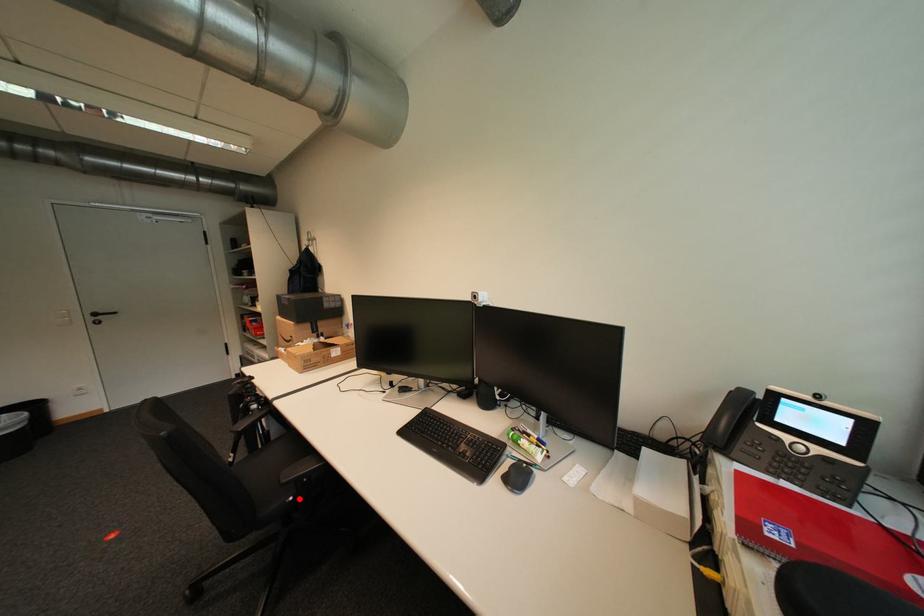
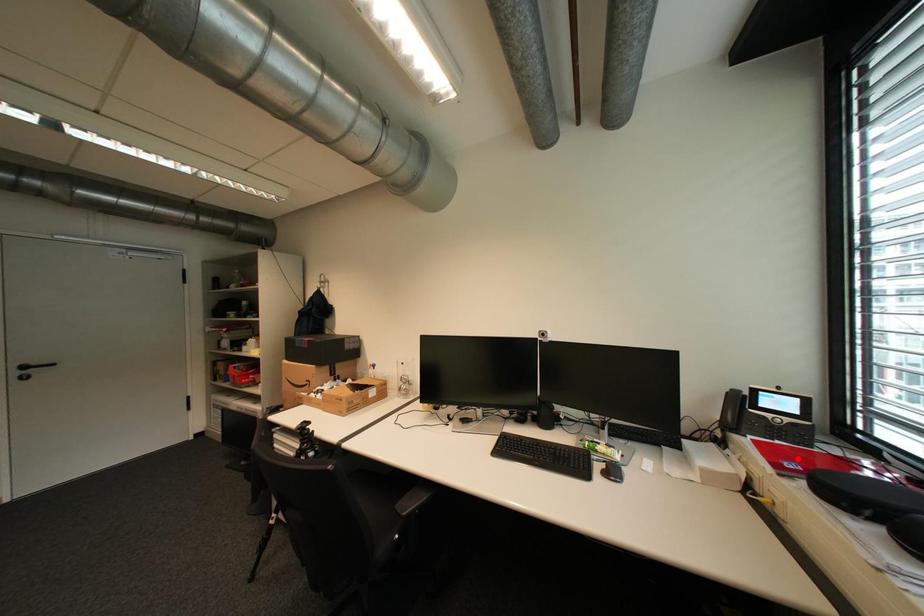
I am providing you with two images of the same scene from different viewpoints. A red point is marked on the first image and another point is marked on the second image. Do the highlighted points in image1 and image2 indicate the same real-world spot?

No